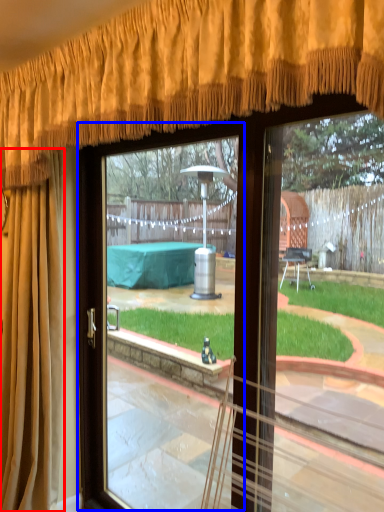
Question: Among these objects, which one is nearest to the camera, curtain (highlighted by a red box) or screen door (highlighted by a blue box)?

Choices:
 (A) curtain
 (B) screen door

Answer: (B)